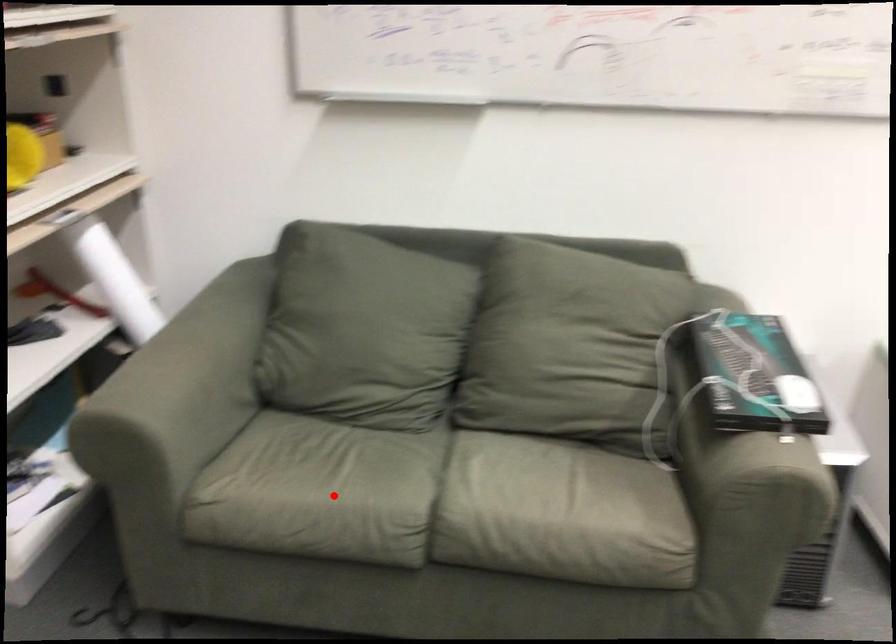
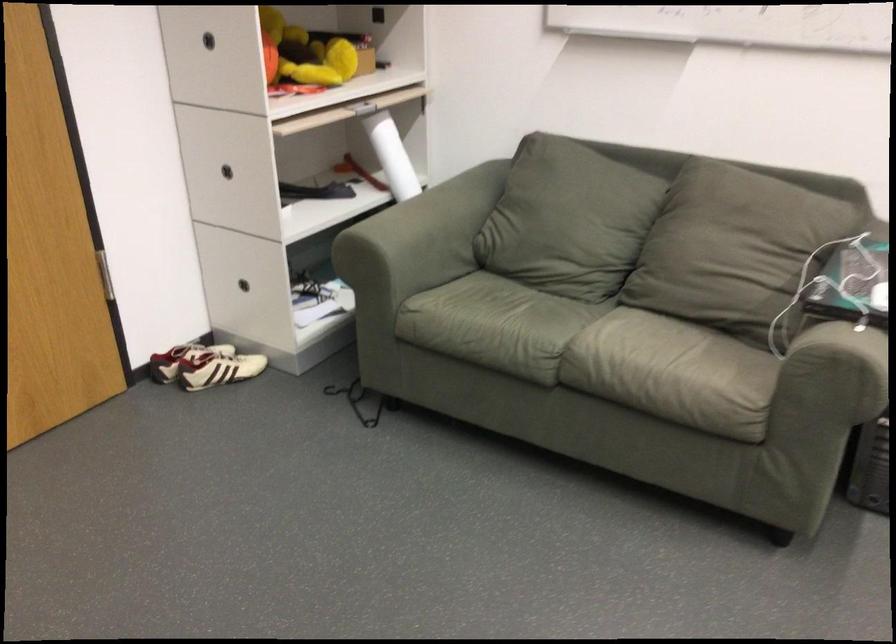
In the second image, find the point that corresponds to the highlighted location in the first image.

(495, 325)